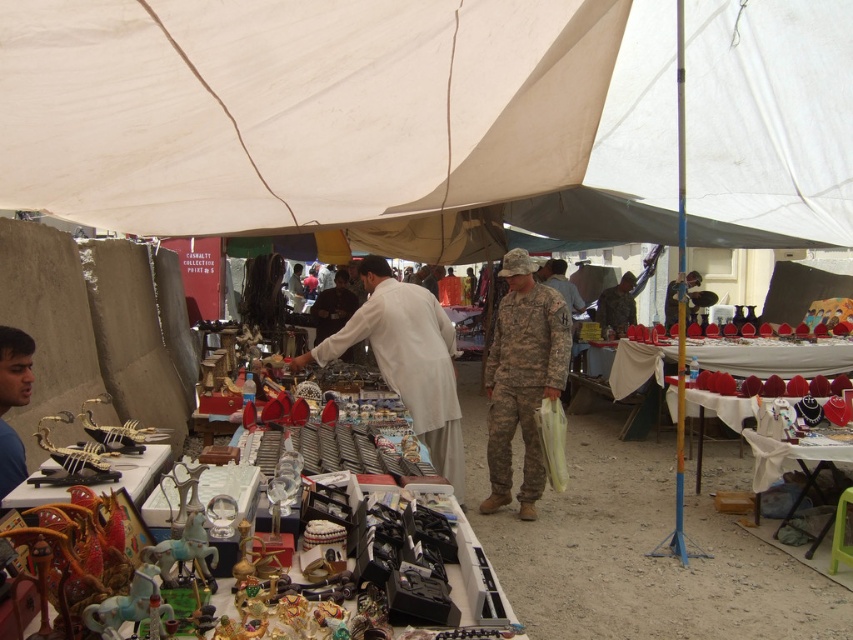
You are standing at the entrance of the market and want to locate the white fabric canopy at upper center. According to the coordinates provided, where should you look relative to the center of the image?

The white fabric canopy at upper center is located at point 0.177 on the x axis and 0.400 on the y axis, which means it is positioned to the left and slightly above the center of the image.

In the scene shown: You are a customer at the market and want to buy a souvenir. You see the white fabric canopy at upper center and the camouflage uniform at center. Which object is wider?

The white fabric canopy at upper center is wider than the camouflage uniform at center because its width surpasses the camouflage uniform at center.